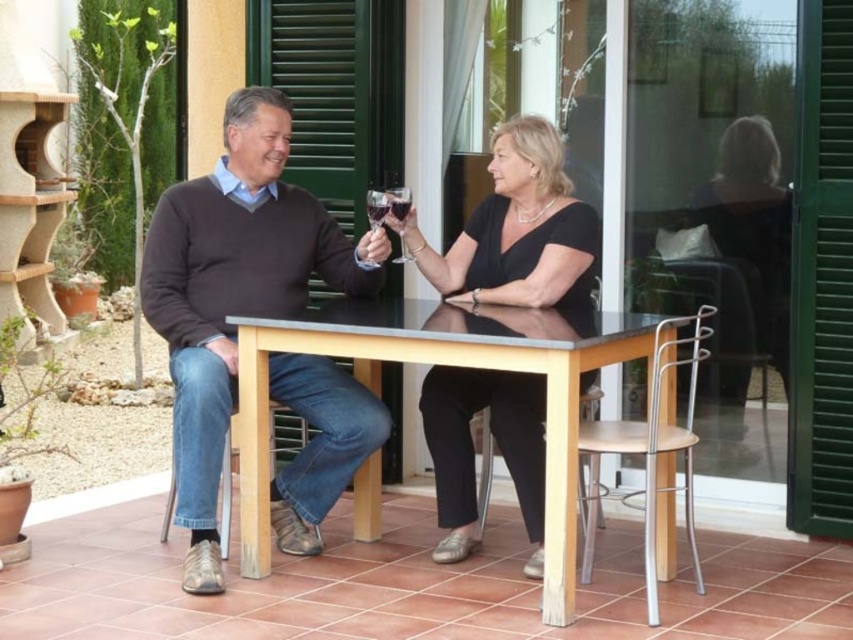
Question: Is black matte dress at center smaller than clear glass wine glass at center?

Choices:
 (A) yes
 (B) no

Answer: (B)

Question: From the image, what is the correct spatial relationship of transparent glass at upper center in relation to translucent glass at center?

Choices:
 (A) below
 (B) above

Answer: (A)

Question: Which point is closer to the camera?

Choices:
 (A) (396, 211)
 (B) (399, 211)
 (C) (383, 216)
 (D) (541, 282)

Answer: (D)

Question: Which point is farther from the camera taking this photo?

Choices:
 (A) (294, 369)
 (B) (737, 256)

Answer: (B)

Question: Which point appears farthest from the camera in this image?

Choices:
 (A) coord(399,236)
 (B) coord(369,205)
 (C) coord(503,225)

Answer: (A)

Question: Is light wood table at center to the right of translucent glass wine at center from the viewer's perspective?

Choices:
 (A) yes
 (B) no

Answer: (A)